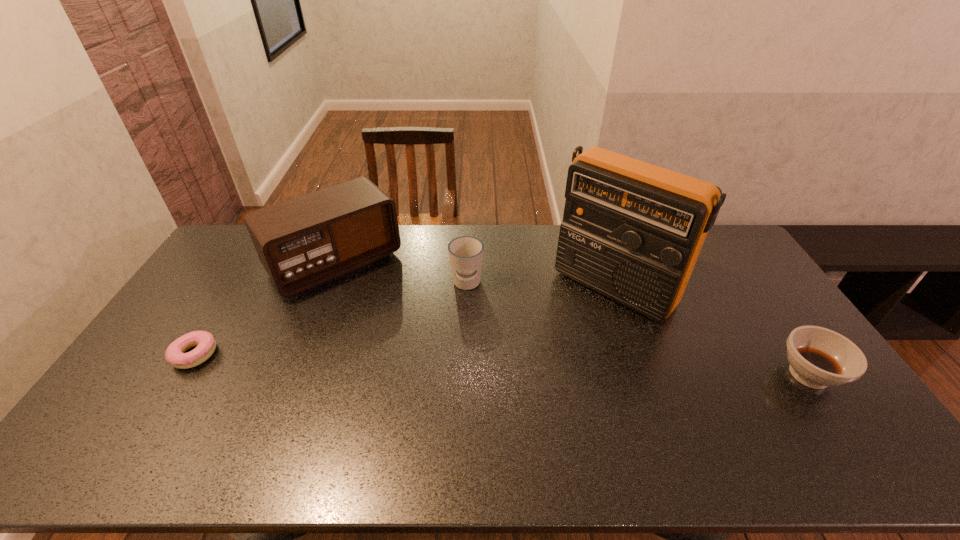
Locate an element on the screen. Image resolution: width=960 pixels, height=540 pixels. empty space between the shortest object and the second object from right to left is located at coordinates (404, 321).

Identify the location of vacant space that's between the third object from right to left and the soup bowl. (637, 329).

The image size is (960, 540). What are the coordinates of `free space between the taller radio receiver and the leftmost object` in the screenshot? It's located at (404, 321).

This screenshot has width=960, height=540. Identify the location of free space between the shortest object and the taller radio receiver. (404, 321).

Find the location of a particular element. Image resolution: width=960 pixels, height=540 pixels. vacant area that lies between the second tallest object and the fourth tallest object is located at coordinates (572, 319).

Find the location of a particular element. The width and height of the screenshot is (960, 540). vacant point located between the soup bowl and the shortest object is located at coordinates (502, 364).

You are a GUI agent. You are given a task and a screenshot of the screen. Output one action in this format:
    pyautogui.click(x=<x>, y=<y>)
    Task: Click on the free space between the cup and the second tallest object
    This screenshot has width=960, height=540.
    Given the screenshot: What is the action you would take?
    pyautogui.click(x=401, y=273)

Where is `vacant space that is in between the right radio receiver and the shortest object`? This screenshot has height=540, width=960. vacant space that is in between the right radio receiver and the shortest object is located at coordinates (404, 321).

Locate which object is the second closest to the cup. Please provide its 2D coordinates. Your answer should be formatted as a tuple, i.e. [(x, y)], where the tuple contains the x and y coordinates of a point satisfying the conditions above.

[(632, 231)]

Image resolution: width=960 pixels, height=540 pixels. Find the location of `object that is the fourth closest to the taller radio receiver`. object that is the fourth closest to the taller radio receiver is located at coordinates (175, 354).